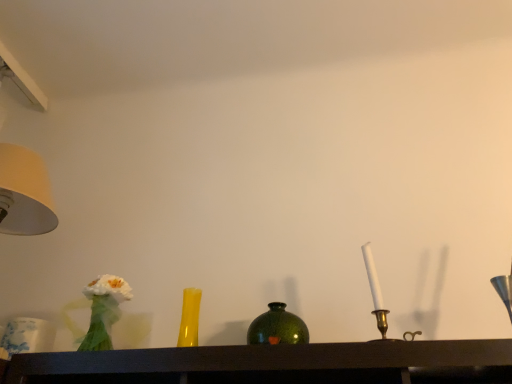
Question: Choose the correct answer: Is white fabric flower at left inside green glass vase at center or outside it?

Choices:
 (A) inside
 (B) outside

Answer: (B)

Question: From their relative heights in the image, would you say white fabric flower at left is taller or shorter than green glass vase at center?

Choices:
 (A) short
 (B) tall

Answer: (B)

Question: Which object is the farthest from the green glass vase at center?

Choices:
 (A) matte yellow glass vase at center
 (B) white fabric flower at left
 (C) white porcelain candle at right

Answer: (B)

Question: Estimate the real-world distances between objects in this image. Which object is farther from the matte yellow glass vase at center?

Choices:
 (A) white porcelain candle at right
 (B) white fabric flower at left
 (C) green glass vase at center

Answer: (A)